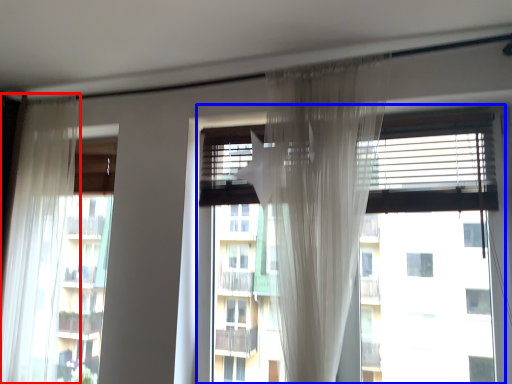
Question: Which of the following is the farthest to the observer, curtain (highlighted by a red box) or window (highlighted by a blue box)?

Choices:
 (A) curtain
 (B) window

Answer: (A)